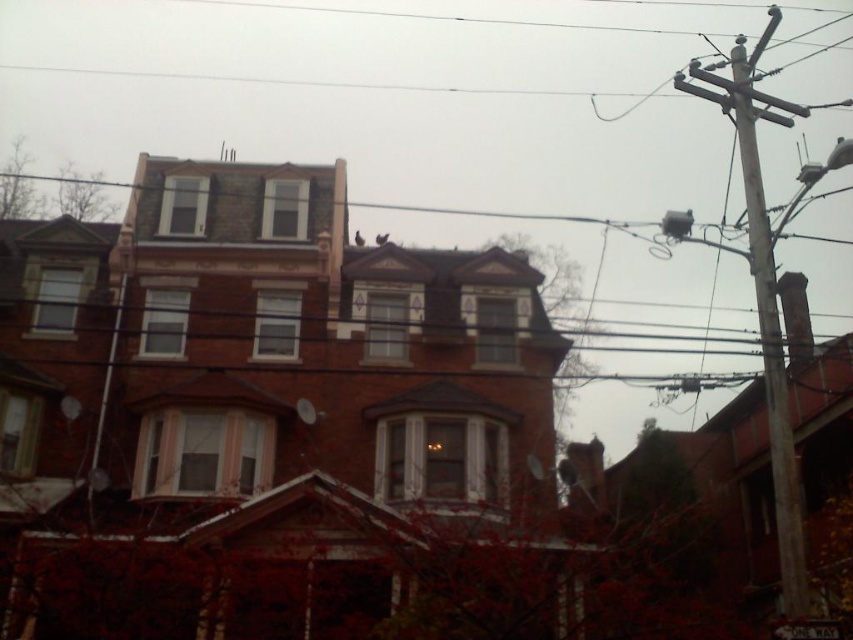
Who is positioned more to the right, wooden utility pole at right or white plastic street sign at upper center?

From the viewer's perspective, wooden utility pole at right appears more on the right side.

Identify the location of wooden utility pole at right. This screenshot has width=853, height=640. (764, 296).

You are a GUI agent. You are given a task and a screenshot of the screen. Output one action in this format:
    pyautogui.click(x=<x>, y=<y>)
    Task: Click on the wooden utility pole at right
    
    Given the screenshot: What is the action you would take?
    [764, 296]